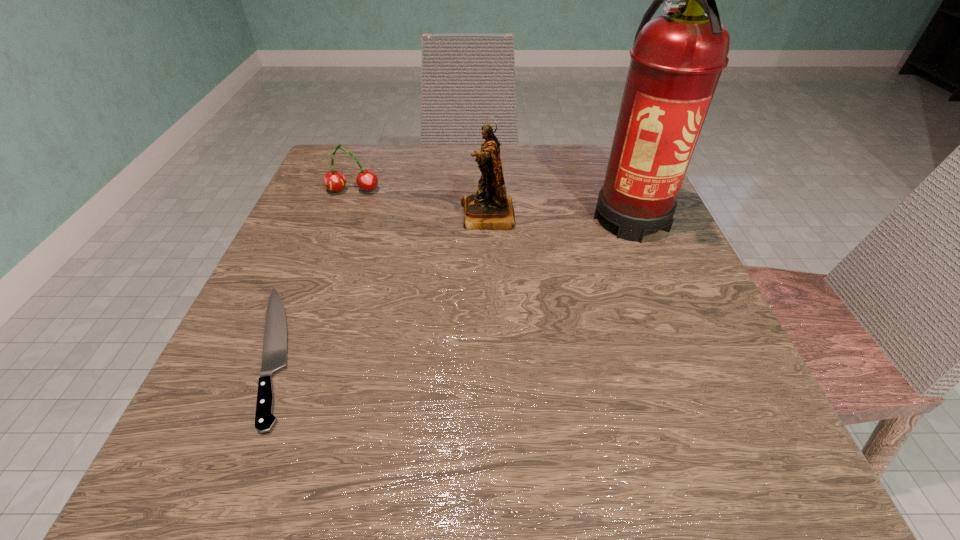
Where is `free space that satisfies the following two spatial constraints: 1. on the front-facing side of the second tallest object; 2. on the front side of the steak knife`? Image resolution: width=960 pixels, height=540 pixels. free space that satisfies the following two spatial constraints: 1. on the front-facing side of the second tallest object; 2. on the front side of the steak knife is located at coordinates (491, 352).

You are a GUI agent. You are given a task and a screenshot of the screen. Output one action in this format:
    pyautogui.click(x=<x>, y=<y>)
    Task: Click on the free space that satisfies the following two spatial constraints: 1. on the front-facing side of the second object from right to left; 2. on the front side of the nearest object
    This screenshot has width=960, height=540.
    Given the screenshot: What is the action you would take?
    pyautogui.click(x=491, y=352)